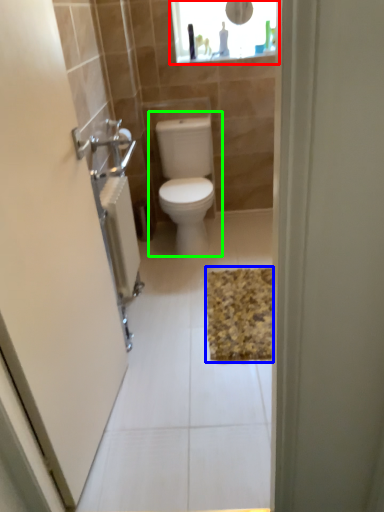
Question: Considering the real-world distances, which object is farthest from medicine cabinet (highlighted by a red box)? bath mat (highlighted by a blue box) or toilet (highlighted by a green box)?

Choices:
 (A) bath mat
 (B) toilet

Answer: (A)